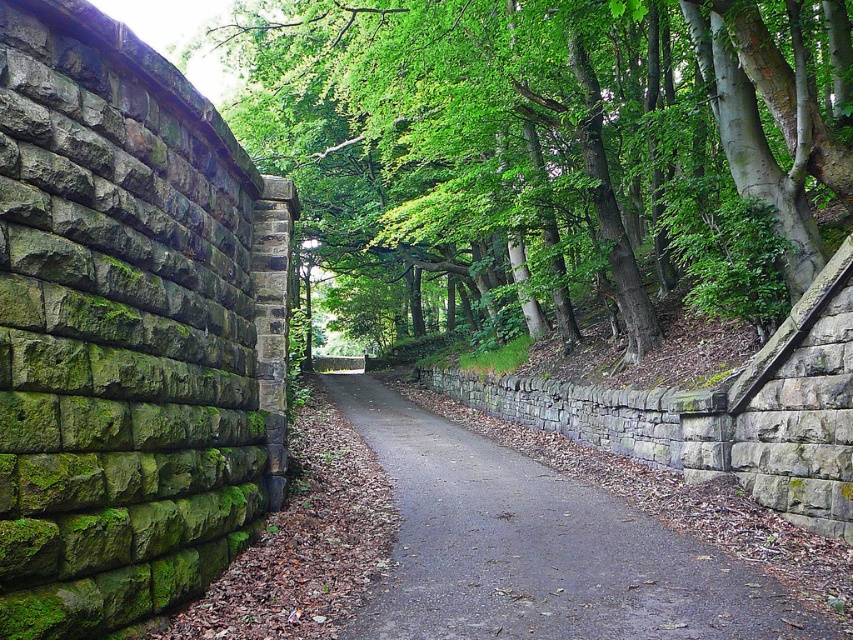
Question: Among these objects, which one is nearest to the camera?

Choices:
 (A) gray stone wall at center
 (B) green leafy tree at center

Answer: (A)

Question: Does green leafy tree at center appear over gray stone wall at center?

Choices:
 (A) no
 (B) yes

Answer: (B)

Question: Does green leafy tree at center lie behind gray stone wall at center?

Choices:
 (A) no
 (B) yes

Answer: (B)

Question: Does green leafy tree at center have a greater width compared to gray stone wall at center?

Choices:
 (A) yes
 (B) no

Answer: (A)